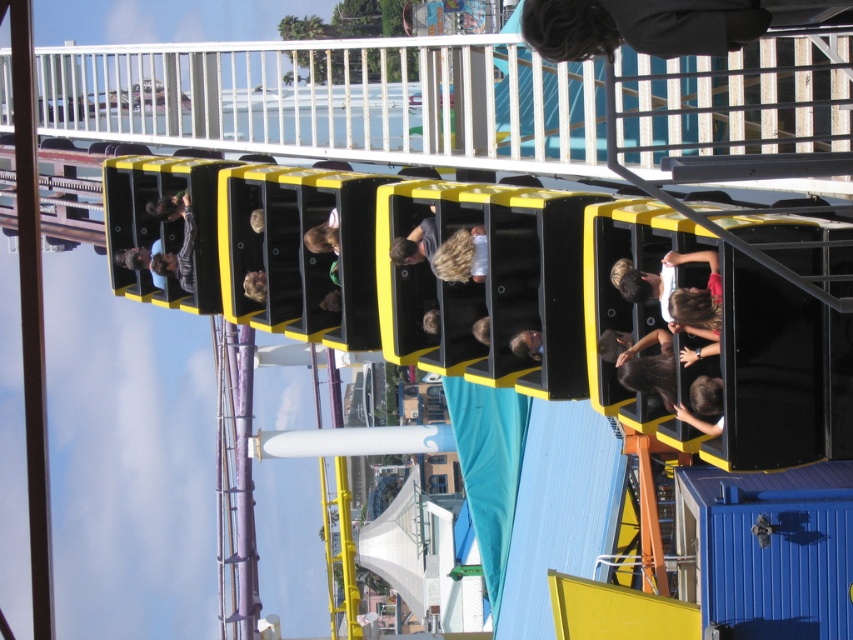
Question: Among these points, which one is nearest to the camera?

Choices:
 (A) (666, 342)
 (B) (521, 339)

Answer: (A)

Question: Which point is closer to the camera taking this photo?

Choices:
 (A) (537, 358)
 (B) (721, 0)
 (C) (701, 262)

Answer: (B)

Question: Does matte black hair at center have a larger size compared to shiny brown hair at center?

Choices:
 (A) yes
 (B) no

Answer: (A)

Question: Which is farther from the dark gray sweater at upper center?

Choices:
 (A) shiny brown hair at center
 (B) matte black hair at center

Answer: (A)

Question: Can you confirm if matte black hair at center is positioned above shiny brown hair at center?

Choices:
 (A) yes
 (B) no

Answer: (B)

Question: Is dark gray sweater at upper center wider than matte black hair at center?

Choices:
 (A) yes
 (B) no

Answer: (B)